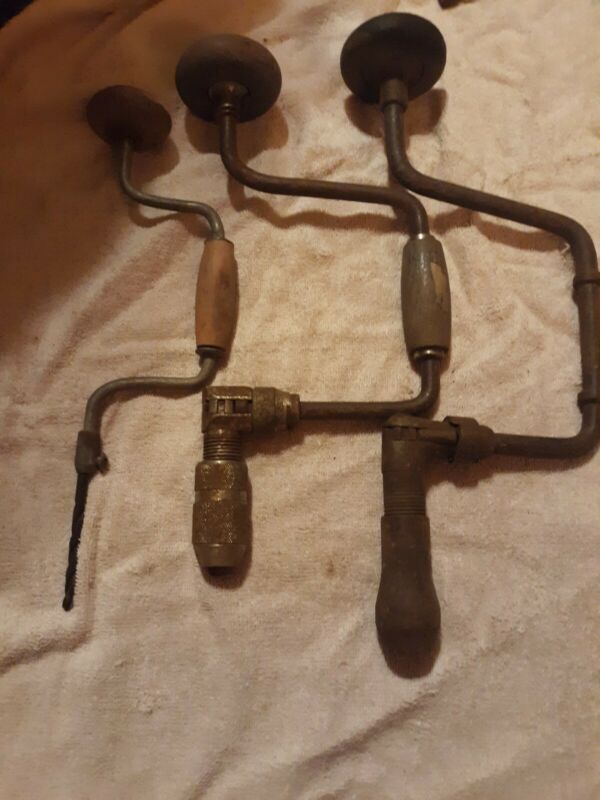
Where is `knob`? The width and height of the screenshot is (600, 800). knob is located at coordinates (135, 106), (247, 66), (391, 42).